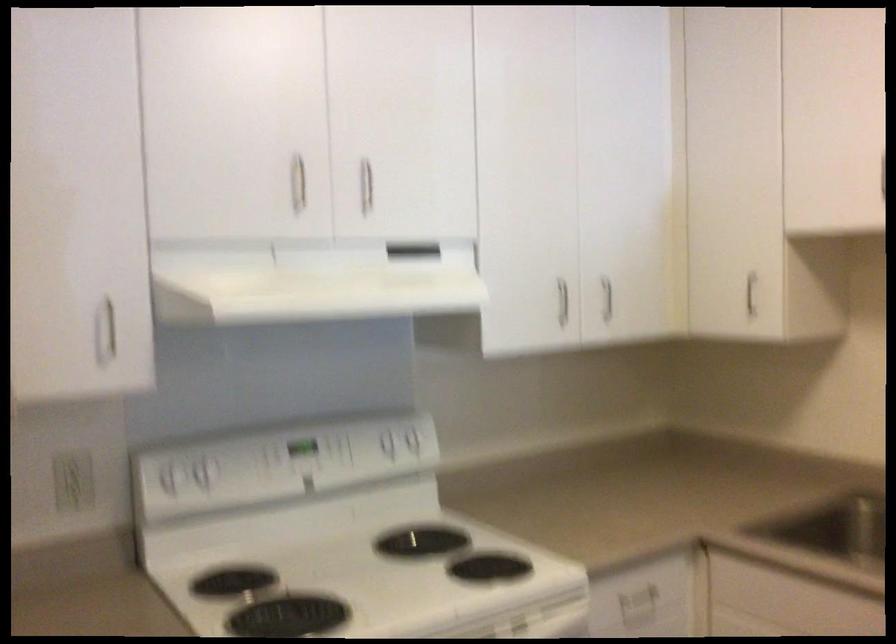
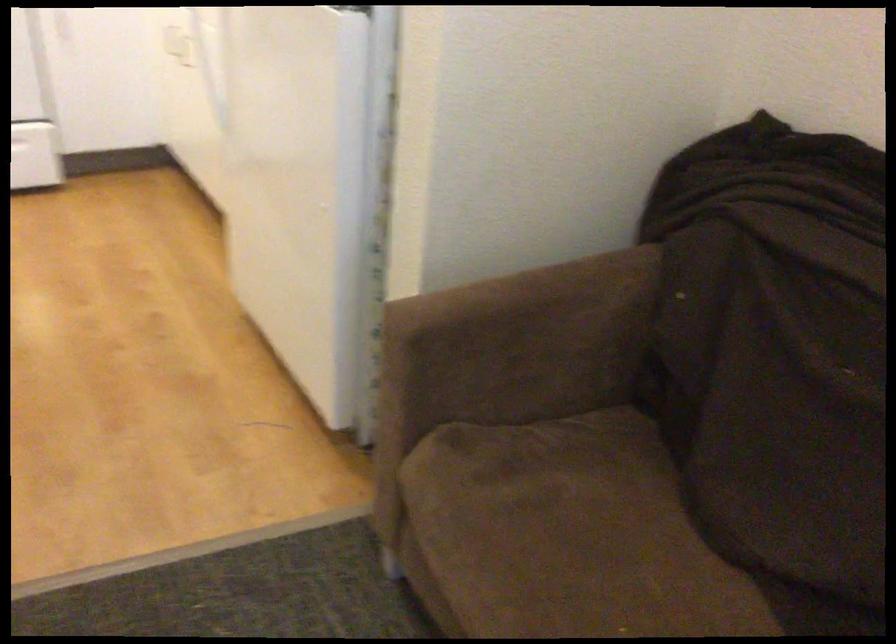
What movement of the cameraman would produce the second image?

The movement direction of the cameraman is right, backward.